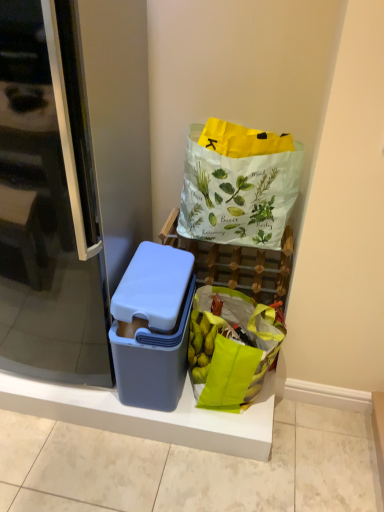
Question: Would you say matte plastic basket at center is to the left or to the right of white paper bag with green leaf illustrations at upper right in the picture?

Choices:
 (A) left
 (B) right

Answer: (A)

Question: Would you say matte plastic basket at center is inside or outside white paper bag with green leaf illustrations at upper right?

Choices:
 (A) inside
 (B) outside

Answer: (B)

Question: Based on their relative distances, which object is farther from the matte plastic basket at center?

Choices:
 (A) transparent plastic container at left
 (B) matte plastic container at left
 (C) green fabric grocery bag at lower right
 (D) white paper bag with green leaf illustrations at upper right
 (E) matte plastic lunch box at center

Answer: (A)

Question: Considering the real-world distances, which object is farthest from the transparent plastic container at left?

Choices:
 (A) white paper bag with green leaf illustrations at upper right
 (B) green fabric grocery bag at lower right
 (C) matte plastic basket at center
 (D) matte plastic lunch box at center
 (E) matte plastic container at left

Answer: (C)